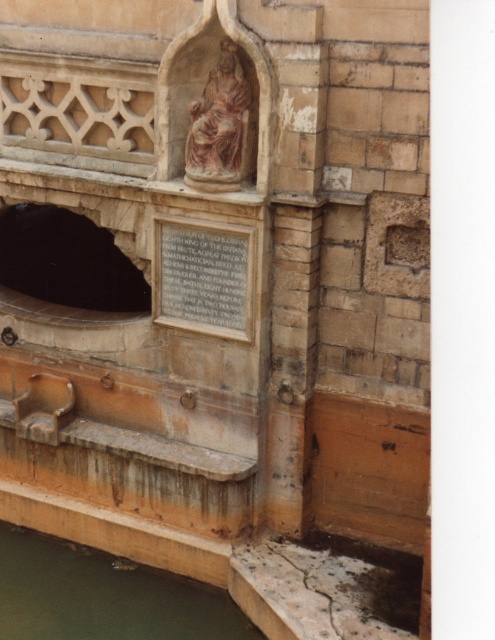
Is point (121, 605) positioned after point (219, 42)?

Yes, it is.

Who is shorter, greenish murky water at lower left or matte pink stone statue at center?

Standing shorter between the two is greenish murky water at lower left.

Who is more distant from viewer, (250, 637) or (212, 173)?

The point (250, 637) is behind.

What are the coordinates of `greenish murky water at lower left` in the screenshot? It's located at (103, 595).

Who is lower down, greenish murky water at lower left or black stone hole at lower left?

Positioned lower is greenish murky water at lower left.

Can you confirm if greenish murky water at lower left is positioned to the left of black stone hole at lower left?

Incorrect, greenish murky water at lower left is not on the left side of black stone hole at lower left.

Does point (57, 564) come in front of point (54, 284)?

Yes, point (57, 564) is closer to viewer.

You are a GUI agent. You are given a task and a screenshot of the screen. Output one action in this format:
    pyautogui.click(x=<x>, y=<y>)
    Task: Click on the greenish murky water at lower left
    The image size is (495, 640).
    Given the screenshot: What is the action you would take?
    pyautogui.click(x=103, y=595)

Does greenish murky water at lower left have a lesser height compared to matte stone plaque at center?

Indeed, greenish murky water at lower left has a lesser height compared to matte stone plaque at center.

Who is positioned more to the left, greenish murky water at lower left or matte stone plaque at center?

Positioned to the left is greenish murky water at lower left.

Identify the location of greenish murky water at lower left. (103, 595).